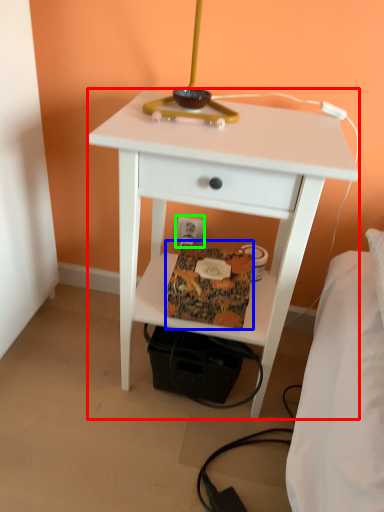
Question: Estimate the real-world distances between objects in this image. Which object is closer to nightstand (highlighted by a red box), package (highlighted by a blue box) or electric outlet (highlighted by a green box)?

Choices:
 (A) package
 (B) electric outlet

Answer: (A)